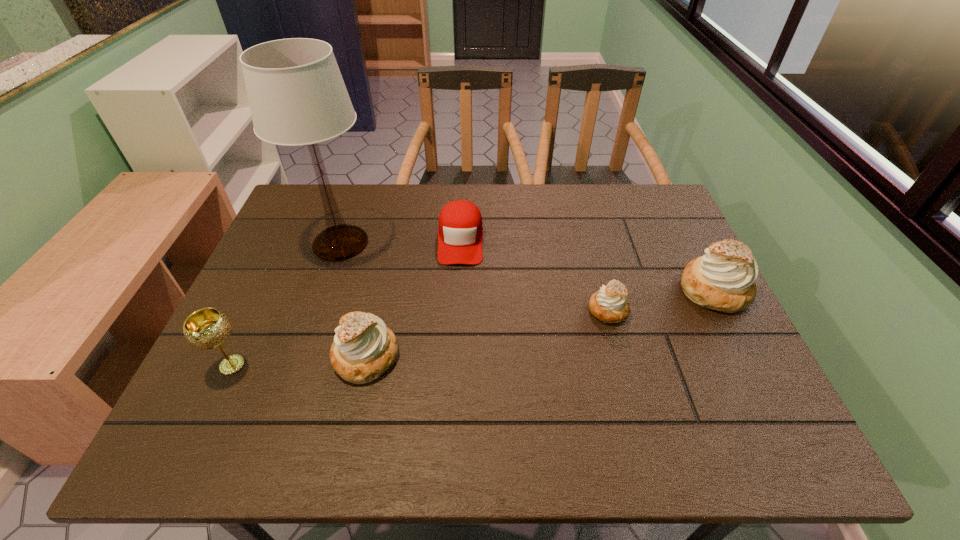
Where is `the second tallest pastry`? This screenshot has height=540, width=960. the second tallest pastry is located at coordinates (363, 349).

Where is `the leftmost pastry`? the leftmost pastry is located at coordinates (363, 349).

This screenshot has height=540, width=960. What are the coordinates of `the shortest pastry` in the screenshot? It's located at (609, 305).

The image size is (960, 540). What are the coordinates of `the second pastry from right to left` in the screenshot? It's located at point(609,305).

The height and width of the screenshot is (540, 960). Find the location of `the rightmost pastry`. the rightmost pastry is located at coordinates click(x=723, y=279).

Locate an element on the screen. the tallest object is located at coordinates pyautogui.click(x=297, y=96).

Identify the location of the third object from right to left. Image resolution: width=960 pixels, height=540 pixels. click(x=460, y=234).

I want to click on chalice, so click(207, 328).

What are the coordinates of `vacant region located 0.120m on the back of the nearest pastry` in the screenshot? It's located at (380, 294).

This screenshot has width=960, height=540. Find the location of `vacant region located on the right of the second pastry from right to left`. vacant region located on the right of the second pastry from right to left is located at coordinates (701, 310).